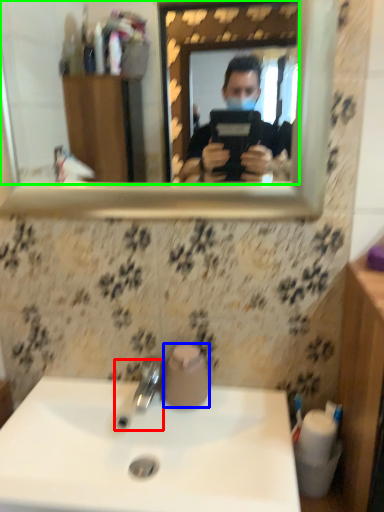
Question: Considering the real-world distances, which object is closest to tap (highlighted by a red box)? toilet paper (highlighted by a blue box) or mirror (highlighted by a green box).

Choices:
 (A) toilet paper
 (B) mirror

Answer: (A)